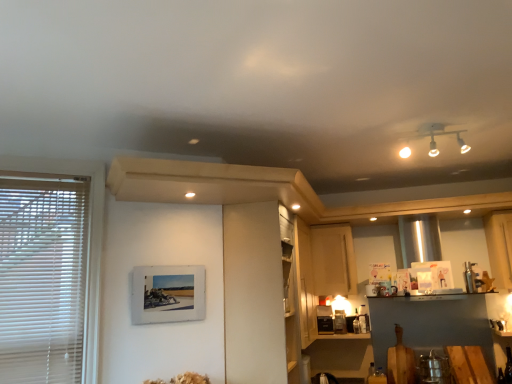
Question: From a real-world perspective, is white matte cabinet at center, which is the 2th cabinetry from right to left, above or below satin black toaster at lower center?

Choices:
 (A) below
 (B) above

Answer: (B)

Question: Which is correct: white matte cabinet at center, the first cabinetry when ordered from front to back, is inside satin black toaster at lower center, or outside of it?

Choices:
 (A) outside
 (B) inside

Answer: (A)

Question: Which is farther from the light wood cabinet at center, marked as the 1th cabinetry in a back-to-front arrangement?

Choices:
 (A) white matte cabinet at center, marked as the 1th cabinetry in a left-to-right arrangement
 (B) white blinds at left
 (C) satin black toaster at lower center
 (D) wooden picture frame at lower left

Answer: (B)

Question: Estimate the real-world distances between objects in this image. Which object is closer to the white matte cabinet at center, which appears as the second cabinetry when viewed from the back?

Choices:
 (A) wooden picture frame at lower left
 (B) white blinds at left
 (C) light wood cabinet at center, positioned as the second cabinetry in front-to-back order
 (D) satin black toaster at lower center

Answer: (A)